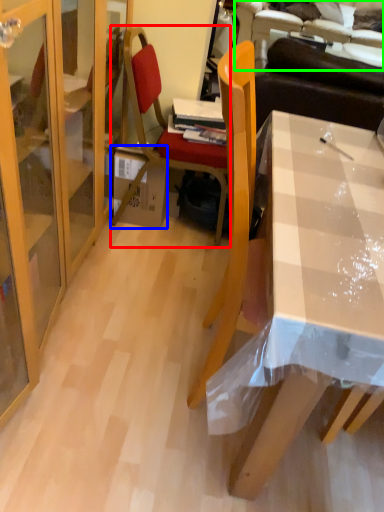
Question: Based on their relative distances, which object is farther from chair (highlighted by a red box)? Choose from box (highlighted by a blue box) and couch (highlighted by a green box).

Choices:
 (A) box
 (B) couch

Answer: (B)